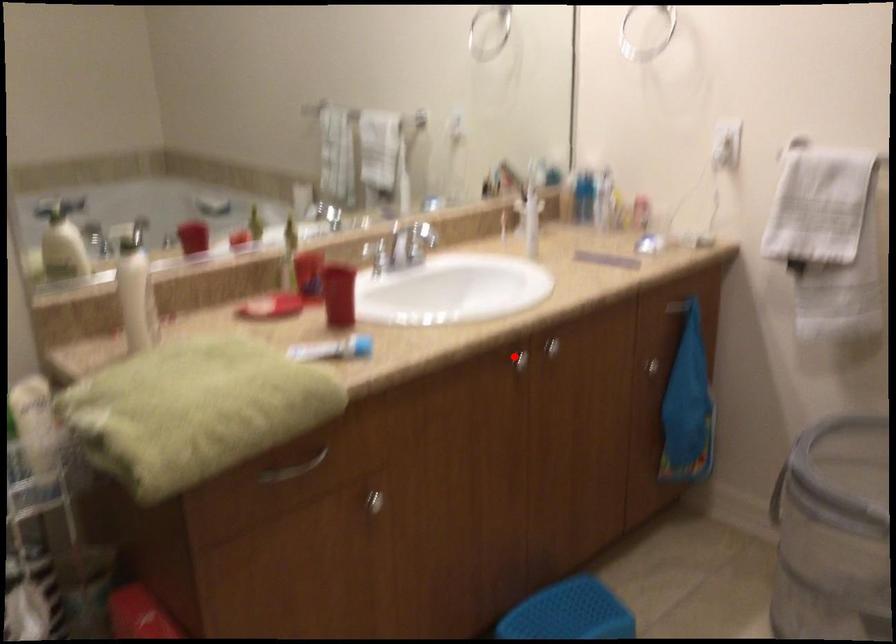
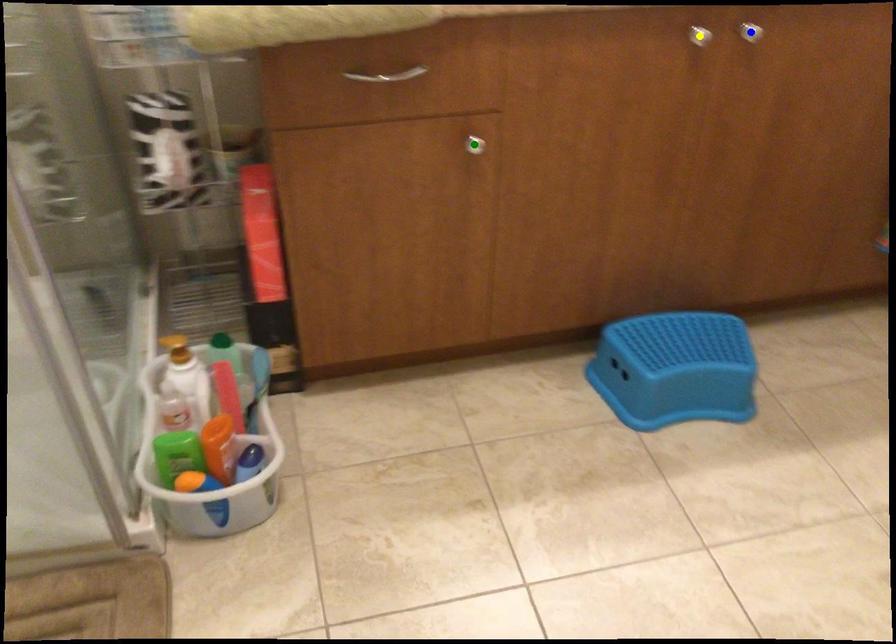
Question: I am providing you with two images of the same scene from different viewpoints. A red point is marked on the first image. You are given multiple points on the second image. Can you choose the point in image 2 that corresponds to the point in image 1?

Choices:
 (A) green point
 (B) yellow point
 (C) blue point

Answer: (B)